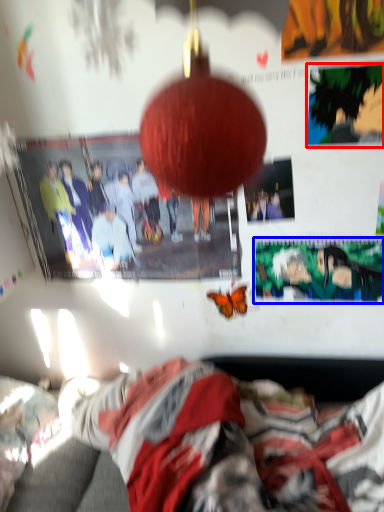
Question: Which object is closer to the camera taking this photo, poster page (highlighted by a red box) or poster page (highlighted by a blue box)?

Choices:
 (A) poster page
 (B) poster page

Answer: (A)